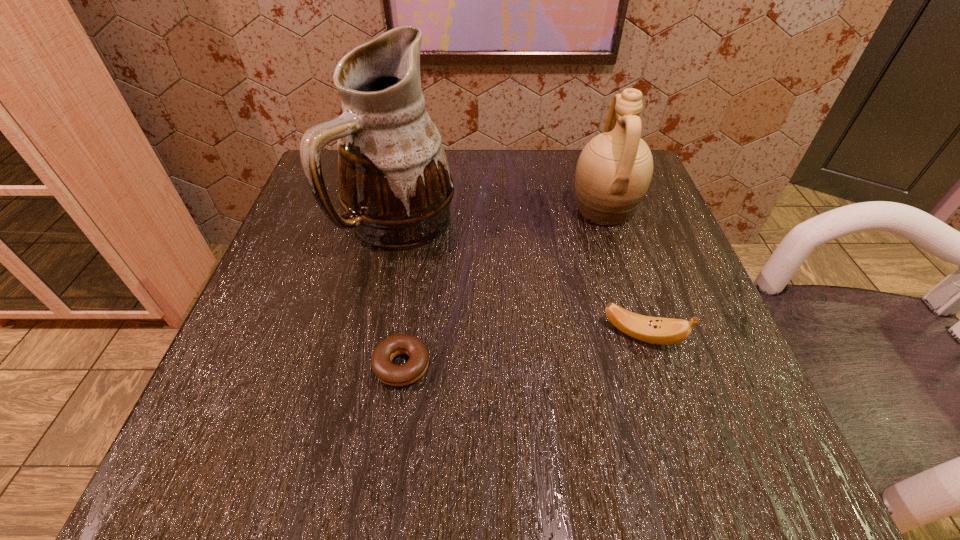
The width and height of the screenshot is (960, 540). I want to click on vacant space that satisfies the following two spatial constraints: 1. from the spout of the taller pitcher; 2. on the right side of the banana, so click(378, 335).

The height and width of the screenshot is (540, 960). Find the location of `free space that satisfies the following two spatial constraints: 1. from the spout of the banana; 2. on the left side of the tallest object`. free space that satisfies the following two spatial constraints: 1. from the spout of the banana; 2. on the left side of the tallest object is located at coordinates [378, 335].

This screenshot has height=540, width=960. What are the coordinates of `vacant space that satisfies the following two spatial constraints: 1. from the spout of the taller pitcher; 2. on the right side of the banana` in the screenshot? It's located at (378, 335).